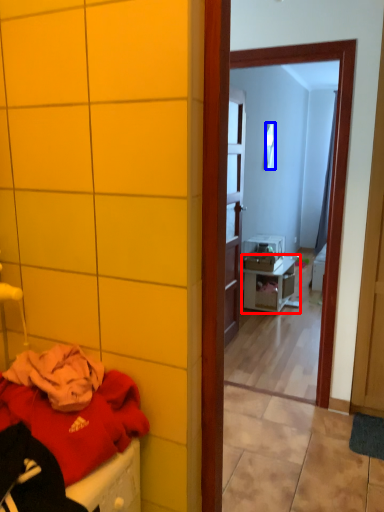
Question: Which point is closer to the camera, nightstand (highlighted by a red box) or mirror (highlighted by a blue box)?

Choices:
 (A) nightstand
 (B) mirror

Answer: (A)